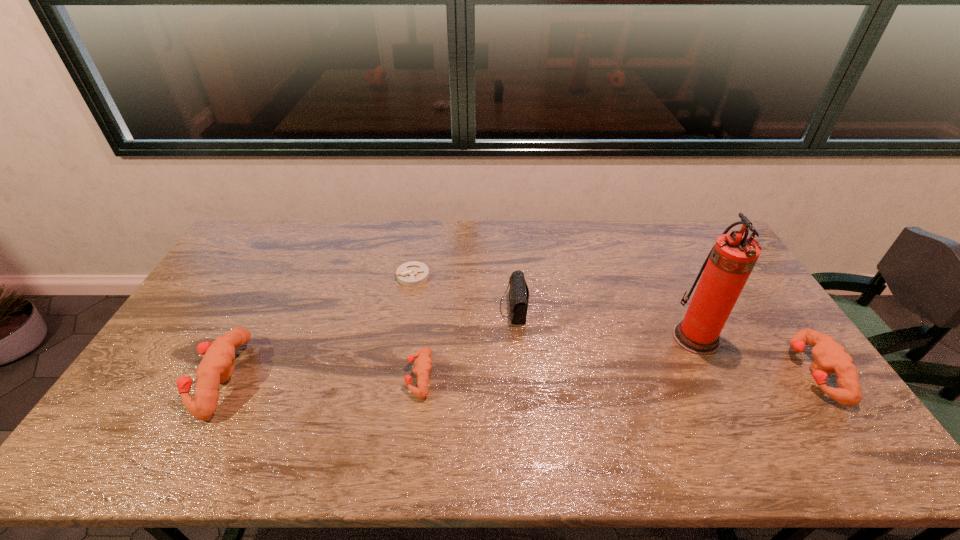
In order to click on the leftmost object in this screenshot , I will do `click(217, 366)`.

At what (x,y) coordinates should I click in order to perform the action: click on the shortest puncher. Please return your answer as a coordinate pair (x, y). Looking at the image, I should click on (423, 364).

Locate an element on the screen. The height and width of the screenshot is (540, 960). the second puncher from right to left is located at coordinates (423, 364).

Locate an element on the screen. Image resolution: width=960 pixels, height=540 pixels. the rightmost object is located at coordinates (830, 357).

Find the location of `the second shortest puncher`. the second shortest puncher is located at coordinates (830, 357).

The image size is (960, 540). Find the location of `ashtray`. ashtray is located at coordinates (414, 273).

Identify the location of the farthest object. (414, 273).

The width and height of the screenshot is (960, 540). What are the coordinates of `clutch bag` in the screenshot? It's located at (518, 293).

The width and height of the screenshot is (960, 540). In order to click on the tallest object in this screenshot , I will do `click(730, 262)`.

I want to click on fire extinguisher, so 730,262.